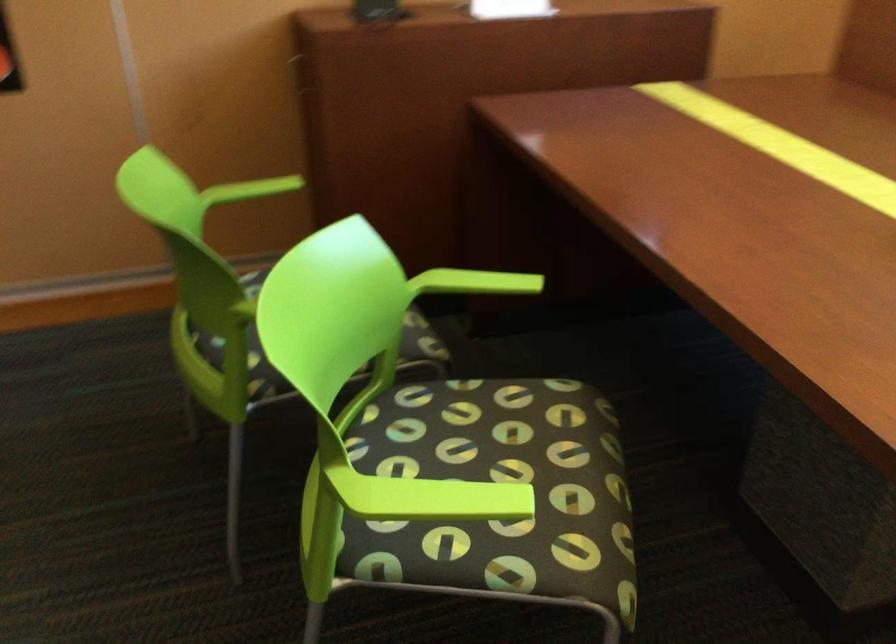
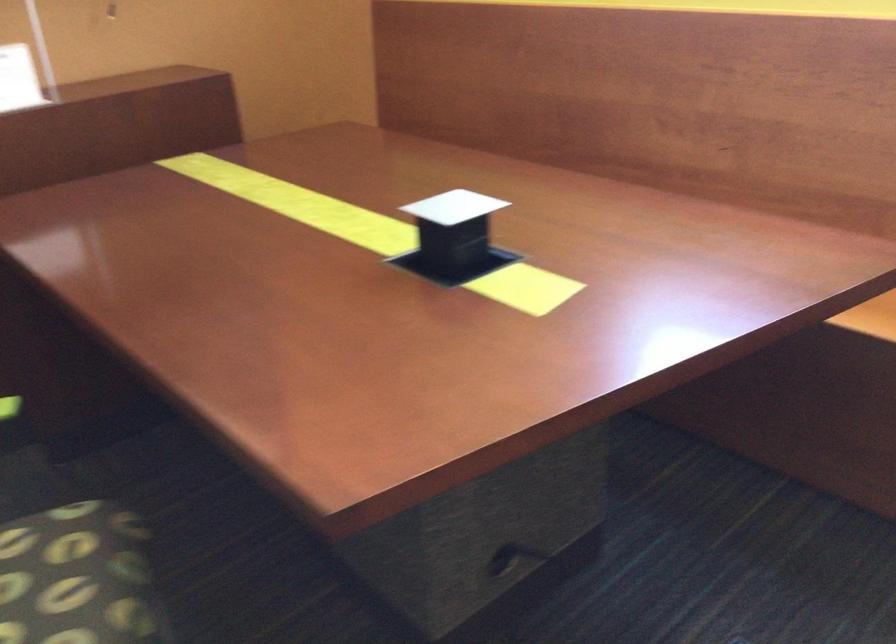
The point at (x=556, y=450) is marked in the first image. Where is the corresponding point in the second image?

(74, 576)